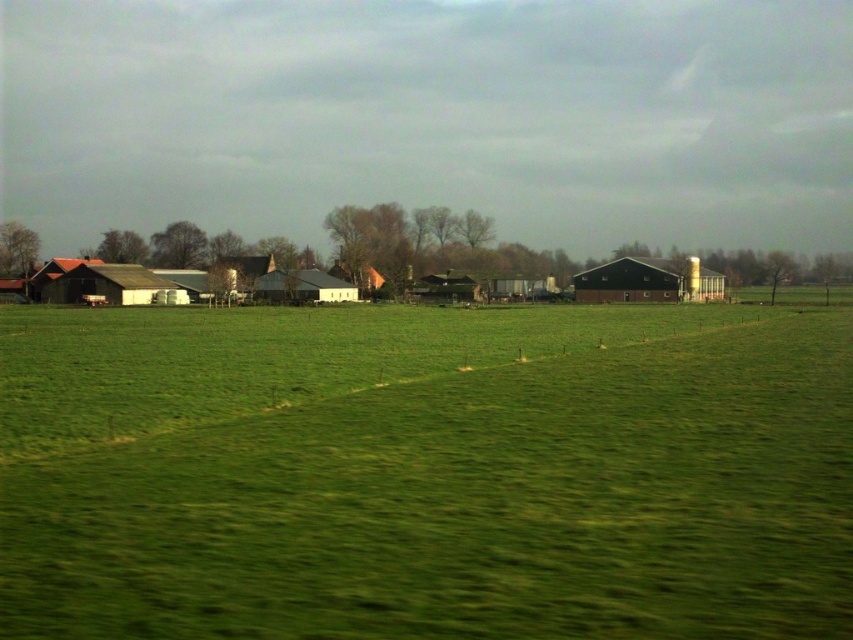
Question: Which point appears closest to the camera in this image?

Choices:
 (A) (264, 282)
 (B) (114, 474)
 (C) (463, 298)

Answer: (B)

Question: Estimate the real-world distances between objects in this image. Which object is farther from the green grassy field at center?

Choices:
 (A) wooden barn at center
 (B) matte white barn at left

Answer: (A)

Question: Observing the image, what is the correct spatial positioning of green grassy field at center in reference to matte gray barn at center?

Choices:
 (A) below
 (B) above

Answer: (A)

Question: Which object appears closest to the camera in this image?

Choices:
 (A) matte white barn at left
 (B) brown wooden barn at left
 (C) dark brown wooden barn at center

Answer: (A)

Question: Does matte gray barn at center appear on the right side of brown wooden barn at left?

Choices:
 (A) no
 (B) yes

Answer: (B)

Question: Is matte white barn at left wider than matte gray barn at center?

Choices:
 (A) no
 (B) yes

Answer: (B)